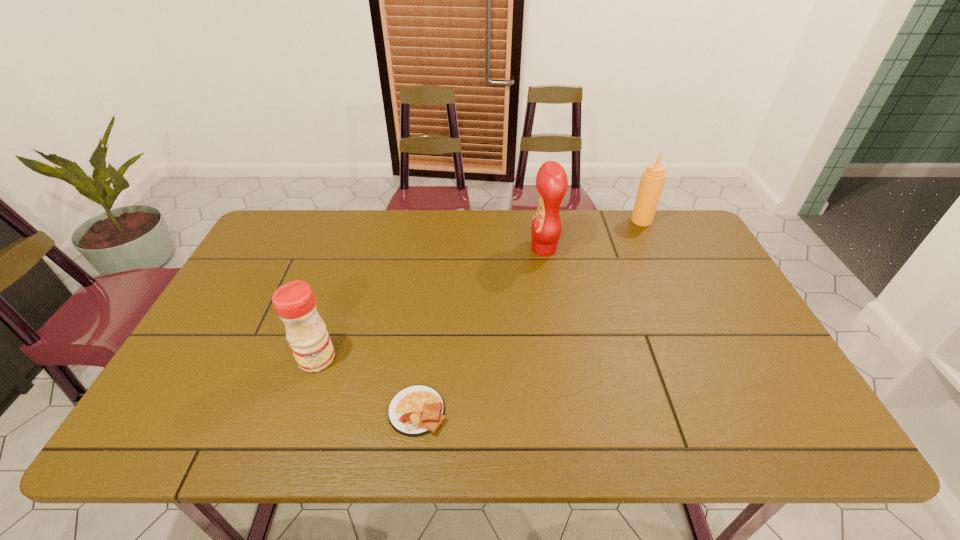
Locate an element on the screen. The image size is (960, 540). free location at the right edge of the desktop is located at coordinates click(778, 373).

Where is `vacant area between the farthest object and the nearest object`? The image size is (960, 540). vacant area between the farthest object and the nearest object is located at coordinates (530, 315).

Image resolution: width=960 pixels, height=540 pixels. Identify the location of empty space that is in between the leftmost object and the third object from right to left. (367, 385).

At what (x,y) coordinates should I click in order to perform the action: click on empty space that is in between the shortest object and the second object from right to left. Please return your answer as a coordinate pair (x, y). The image size is (960, 540). Looking at the image, I should click on (481, 329).

The width and height of the screenshot is (960, 540). What are the coordinates of `free space between the nearest condiment and the shortest object` in the screenshot? It's located at (367, 385).

You are a GUI agent. You are given a task and a screenshot of the screen. Output one action in this format:
    pyautogui.click(x=<x>, y=<y>)
    Task: Click on the vacant area that lies between the second condiment from left to right and the nearest condiment
    The image size is (960, 540).
    Given the screenshot: What is the action you would take?
    pyautogui.click(x=430, y=303)

The width and height of the screenshot is (960, 540). In order to click on unoccupied area between the rightmost object and the nearest object in this screenshot , I will do `click(530, 315)`.

Locate an element on the screen. vacant area that lies between the third nearest object and the farthest condiment is located at coordinates (592, 234).

Find the location of `vacant point located between the second farthest object and the leftmost object`. vacant point located between the second farthest object and the leftmost object is located at coordinates (430, 303).

Find the location of `vacant point located between the second nearest object and the rightmost condiment`. vacant point located between the second nearest object and the rightmost condiment is located at coordinates (479, 289).